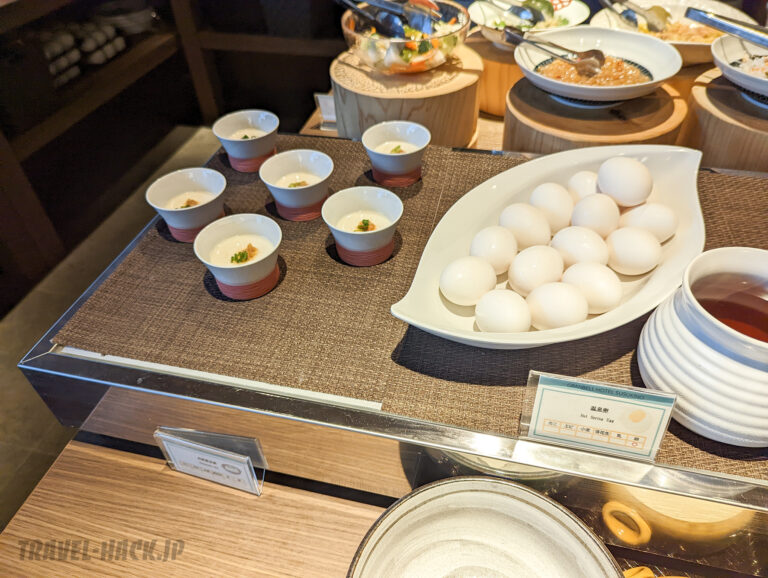
At what (x,y) coordinates should I click in order to perform the action: click on metal frame. Please return your answer as a coordinate pair (x, y). Looking at the image, I should click on (134, 399).